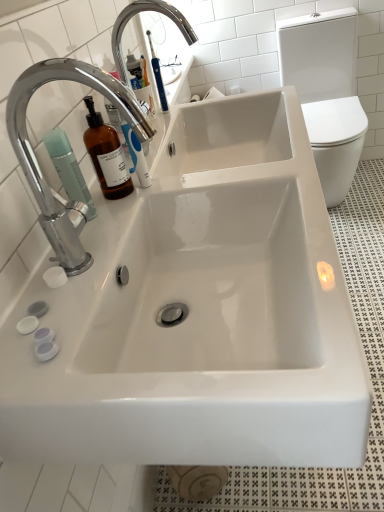
Question: In the image, is chrome metallic faucet at upper left, which is the second tap from bottom to top, positioned in front of or behind white glossy toilet bowl at right?

Choices:
 (A) behind
 (B) front

Answer: (B)

Question: From their relative heights in the image, would you say chrome metallic faucet at upper left, which appears as the first tap when viewed from the back, is taller or shorter than white glossy toilet bowl at right?

Choices:
 (A) tall
 (B) short

Answer: (B)

Question: Which object is the closest to the white glossy toilet bowl at right?

Choices:
 (A) chrome metallic faucet at upper left, the 1th tap when ordered from top to bottom
 (B) chrome/metallic faucet at upper left, acting as the second tap starting from the top
 (C) matte green pump bottle at left

Answer: (A)

Question: Which object is the closest to the chrome/metallic faucet at upper left, the second tap when ordered from back to front?

Choices:
 (A) matte green pump bottle at left
 (B) chrome metallic faucet at upper left, which is the second tap from bottom to top
 (C) white glossy toilet bowl at right

Answer: (A)